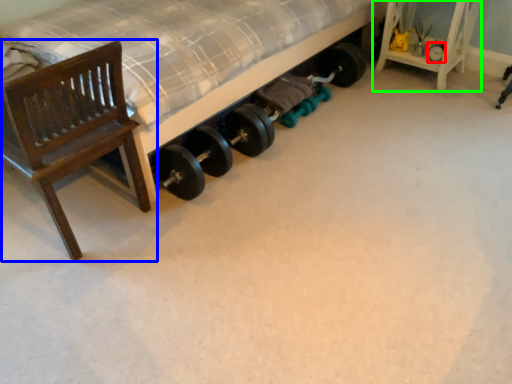
Question: Estimate the real-world distances between objects in this image. Which object is farther from tire (highlighted by a red box), chair (highlighted by a blue box) or furniture (highlighted by a green box)?

Choices:
 (A) chair
 (B) furniture

Answer: (A)